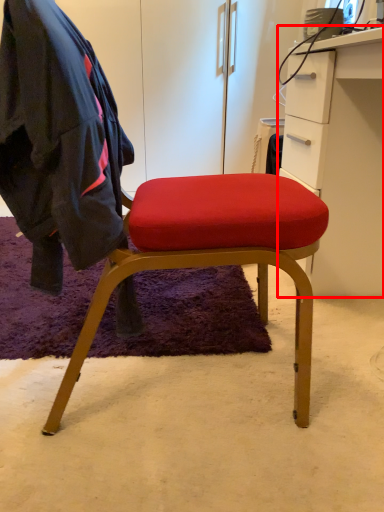
Question: From the image's perspective, what is the correct spatial positioning of cabinetry (annotated by the red box) in reference to clothing?

Choices:
 (A) below
 (B) above

Answer: (B)